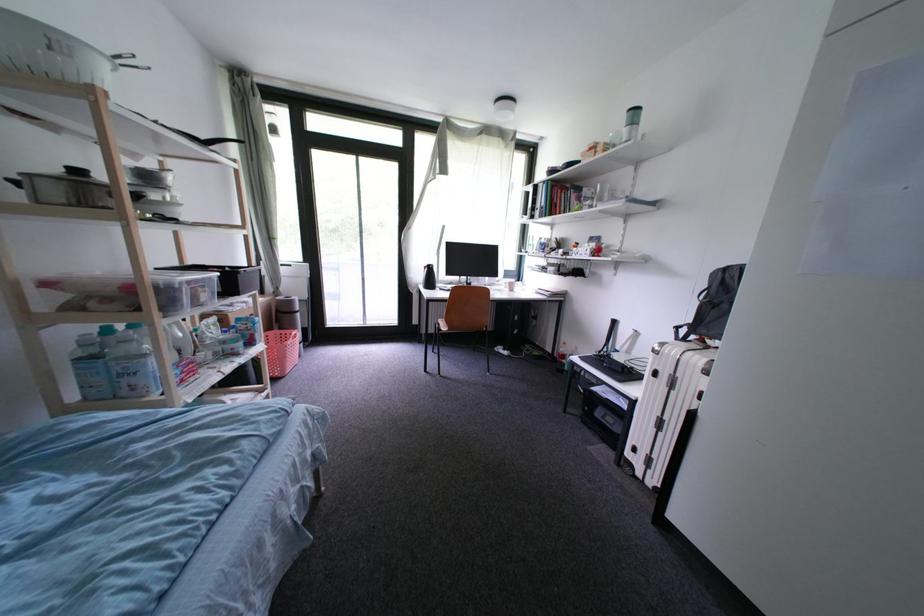
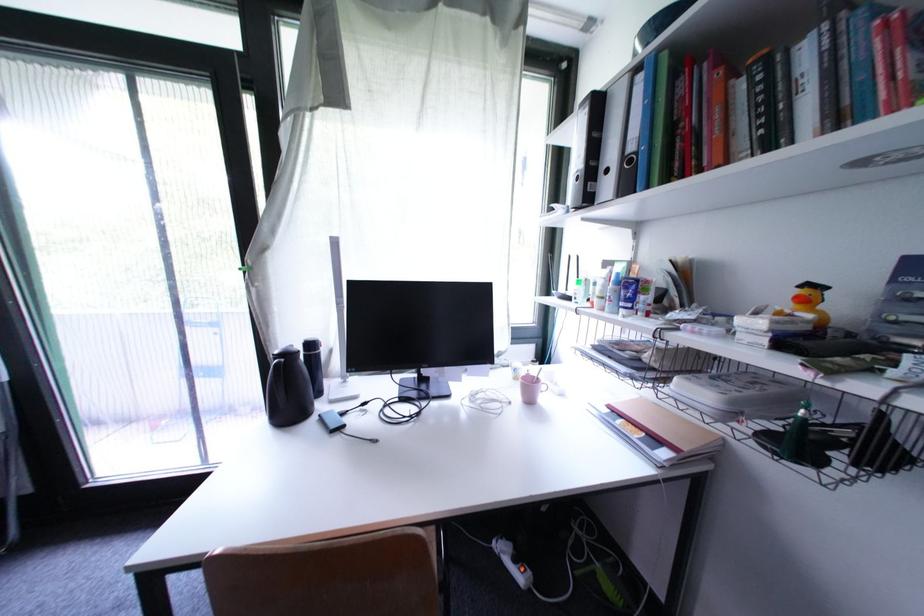
Question: What movement of the cameraman would produce the second image?

Choices:
 (A) Left
 (B) Right
 (C) Forward
 (D) Backward

Answer: (C)